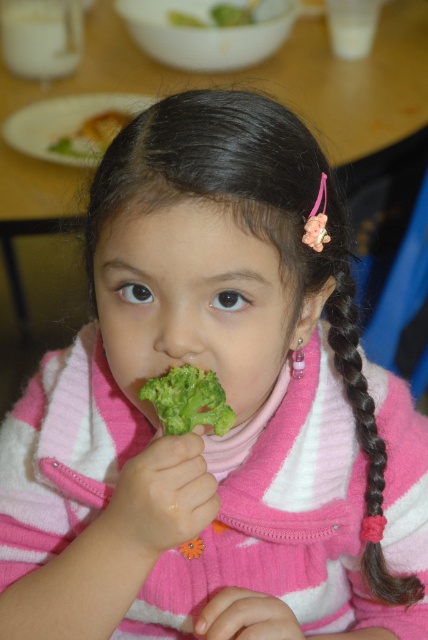
Question: Among these points, which one is nearest to the camera?

Choices:
 (A) (183, 412)
 (B) (100, 120)

Answer: (A)

Question: Can you confirm if green matte broccoli at mouth is positioned above green broccoli at center?

Choices:
 (A) yes
 (B) no

Answer: (B)

Question: Among these objects, which one is farthest from the camera?

Choices:
 (A) green matte broccoli at mouth
 (B) green broccoli at center

Answer: (B)

Question: Which of the following is the farthest from the observer?

Choices:
 (A) green matte broccoli at mouth
 (B) green broccoli at center

Answer: (B)

Question: Can you confirm if green matte broccoli at mouth is positioned below green broccoli at center?

Choices:
 (A) yes
 (B) no

Answer: (A)

Question: Can you confirm if green matte broccoli at mouth is positioned above green broccoli at center?

Choices:
 (A) no
 (B) yes

Answer: (A)